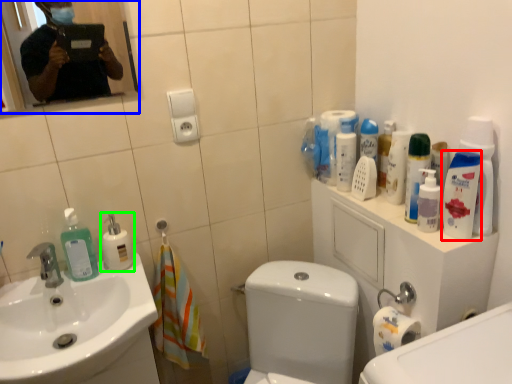
Question: Considering the real-world distances, which object is farthest from mouthwash (highlighted by a red box)? mirror (highlighted by a blue box) or cleaning product (highlighted by a green box)?

Choices:
 (A) mirror
 (B) cleaning product

Answer: (A)